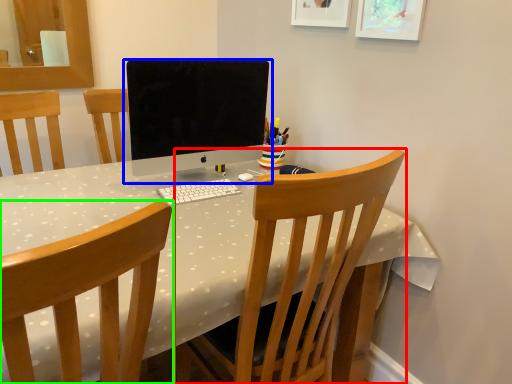
Question: Which is nearer to the chair (highlighted by a red box)? computer monitor (highlighted by a blue box) or chair (highlighted by a green box).

Choices:
 (A) computer monitor
 (B) chair

Answer: (B)